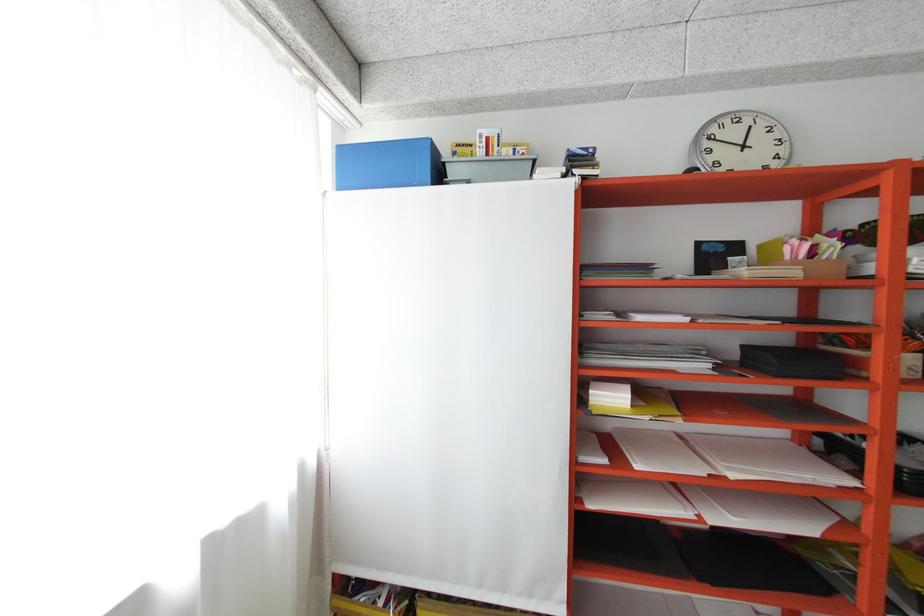
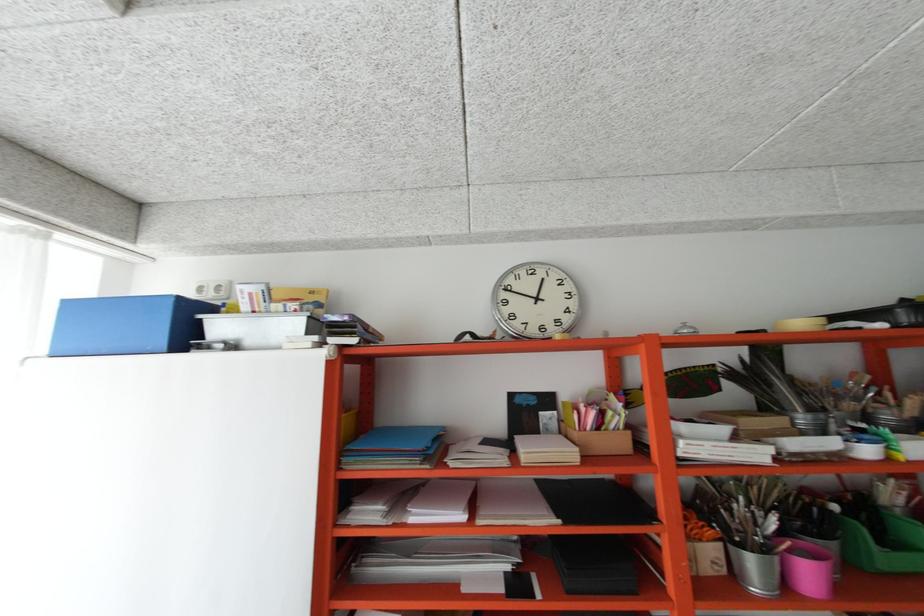
Question: The first image is from the beginning of the video and the second image is from the end. How did the camera likely rotate when shooting the video?

Choices:
 (A) Left
 (B) Right
 (C) Up
 (D) Down

Answer: (C)